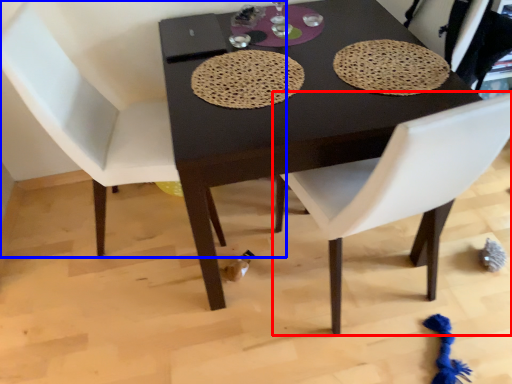
Question: Which of the following is the closest to the observer, chair (highlighted by a red box) or chair (highlighted by a blue box)?

Choices:
 (A) chair
 (B) chair

Answer: (A)